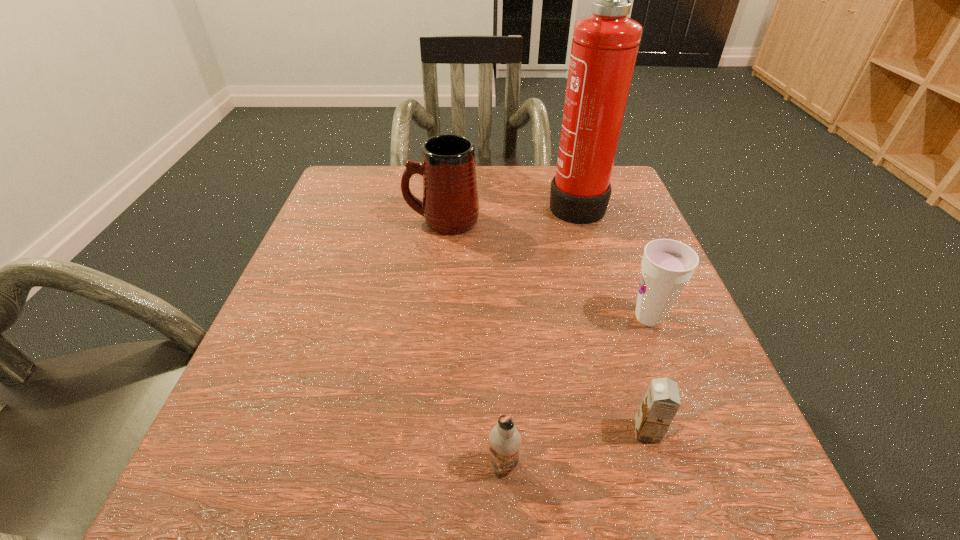
Locate an element on the screen. The image size is (960, 540). free region located 0.150m on the front-facing side of the fire extinguisher is located at coordinates (482, 202).

This screenshot has height=540, width=960. In order to click on vacant space located 0.290m on the front-facing side of the fire extinguisher in this screenshot , I will do `click(421, 202)`.

The height and width of the screenshot is (540, 960). Identify the location of free point located on the side of the leftmost object with the handle. (350, 220).

Locate an element on the screen. free point located on the side of the leftmost object with the handle is located at coordinates (359, 220).

In order to click on vacant space located on the side of the leftmost object with the handle in this screenshot , I will do `click(346, 220)`.

Find the location of a particular element. blank area located on the left of the third nearest object is located at coordinates pos(496,318).

The width and height of the screenshot is (960, 540). Find the location of `vacant position located on the left of the left chocolate milk`. vacant position located on the left of the left chocolate milk is located at coordinates (x=402, y=464).

Identify the location of free space located 0.180m on the left of the farther chocolate milk. This screenshot has width=960, height=540. (500, 431).

I want to click on fire extinguisher located in the far edge section of the desktop, so point(604,49).

Locate an element on the screen. Image resolution: width=960 pixels, height=540 pixels. mug at the far edge is located at coordinates (450, 206).